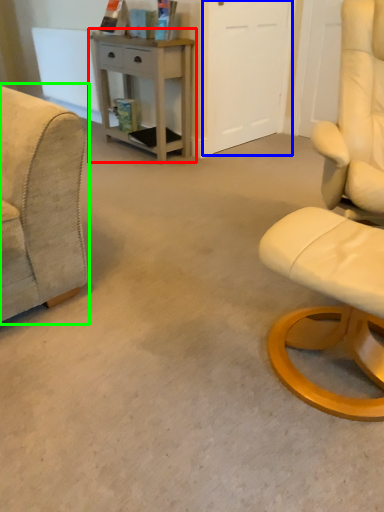
Question: Which is nearer to the desk (highlighted by a red box)? glass door (highlighted by a blue box) or chair (highlighted by a green box).

Choices:
 (A) glass door
 (B) chair

Answer: (A)